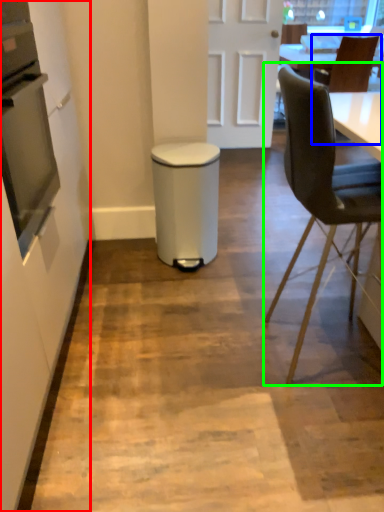
Question: Based on their relative distances, which object is nearer to side (highlighted by a red box)? Choose from chair (highlighted by a blue box) and chair (highlighted by a green box).

Choices:
 (A) chair
 (B) chair

Answer: (B)